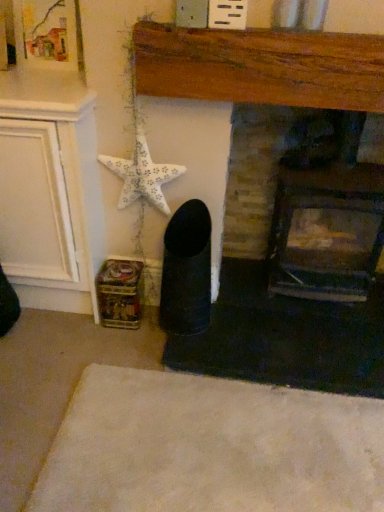
Question: Can you confirm if white matte starfish at upper left is positioned to the left of dark brick fireplace at center, the 2th fireplace when ordered from left to right?

Choices:
 (A) yes
 (B) no

Answer: (A)

Question: Is the position of white matte starfish at upper left less distant than that of dark brick fireplace at center, the 1th fireplace from the right?

Choices:
 (A) yes
 (B) no

Answer: (B)

Question: Could you tell me if white matte starfish at upper left is facing dark brick fireplace at center, the 1th fireplace from the right?

Choices:
 (A) no
 (B) yes

Answer: (A)

Question: Is white matte starfish at upper left not close to dark brick fireplace at center, the 2th fireplace when ordered from left to right?

Choices:
 (A) no
 (B) yes

Answer: (A)

Question: Can you confirm if white matte starfish at upper left is wider than dark brick fireplace at center, the 1th fireplace from the right?

Choices:
 (A) yes
 (B) no

Answer: (B)

Question: Considering the positions of point (51, 480) and point (125, 166), is point (51, 480) closer or farther from the camera than point (125, 166)?

Choices:
 (A) closer
 (B) farther

Answer: (A)

Question: In terms of height, does white soft rug at lower center look taller or shorter compared to white matte starfish at upper left?

Choices:
 (A) tall
 (B) short

Answer: (B)

Question: Is white soft rug at lower center inside or outside of white matte starfish at upper left?

Choices:
 (A) outside
 (B) inside

Answer: (A)

Question: In the image, is white soft rug at lower center positioned in front of or behind white matte starfish at upper left?

Choices:
 (A) front
 (B) behind

Answer: (A)

Question: Is white soft rug at lower center in front of or behind dark brick fireplace at center, the 1th fireplace from the right, in the image?

Choices:
 (A) front
 (B) behind

Answer: (A)

Question: Considering the positions of white soft rug at lower center and dark brick fireplace at center, the 2th fireplace when ordered from left to right, in the image, is white soft rug at lower center taller or shorter than dark brick fireplace at center, the 2th fireplace when ordered from left to right,?

Choices:
 (A) short
 (B) tall

Answer: (A)

Question: In the image, is white soft rug at lower center on the left side or the right side of dark brick fireplace at center, the 1th fireplace from the right?

Choices:
 (A) left
 (B) right

Answer: (A)

Question: Considering the positions of white soft rug at lower center and dark brick fireplace at center, the 1th fireplace from the right, in the image, is white soft rug at lower center bigger or smaller than dark brick fireplace at center, the 1th fireplace from the right,?

Choices:
 (A) small
 (B) big

Answer: (A)

Question: Is point (253, 208) closer or farther from the camera than point (281, 52)?

Choices:
 (A) farther
 (B) closer

Answer: (A)

Question: From the image's perspective, is dark brick fireplace at center, the 1th fireplace from the right, located above or below wooden fireplace at center, the first fireplace positioned from the left?

Choices:
 (A) below
 (B) above

Answer: (A)